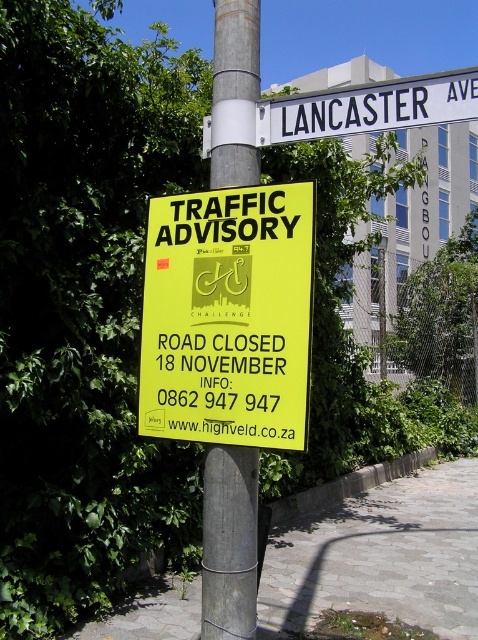
Who is more distant from viewer, (295, 330) or (141, 596)?

The point (141, 596) is behind.

Who is taller, yellow paper sign at center or gray concrete pavement at lower center?

Standing taller between the two is yellow paper sign at center.

Who is more forward, (145, 289) or (311, 560)?

Point (145, 289) is more forward.

This screenshot has height=640, width=478. What are the coordinates of `yellow paper sign at center` in the screenshot? It's located at (228, 316).

The height and width of the screenshot is (640, 478). Describe the element at coordinates (228, 316) in the screenshot. I see `yellow paper sign at center` at that location.

Which is more to the left, yellow paper sign at center or silver metallic pole at center?

silver metallic pole at center

The image size is (478, 640). Find the location of `yellow paper sign at center`. yellow paper sign at center is located at coordinates (228, 316).

Locate an element on the screen. The height and width of the screenshot is (640, 478). yellow paper sign at center is located at coordinates (228, 316).

What do you see at coordinates (228, 544) in the screenshot? This screenshot has width=478, height=640. I see `silver metallic pole at center` at bounding box center [228, 544].

Which is behind, point (240, 179) or point (459, 74)?

The point (240, 179) is more distant.

Image resolution: width=478 pixels, height=640 pixels. Identify the location of silver metallic pole at center. (228, 544).